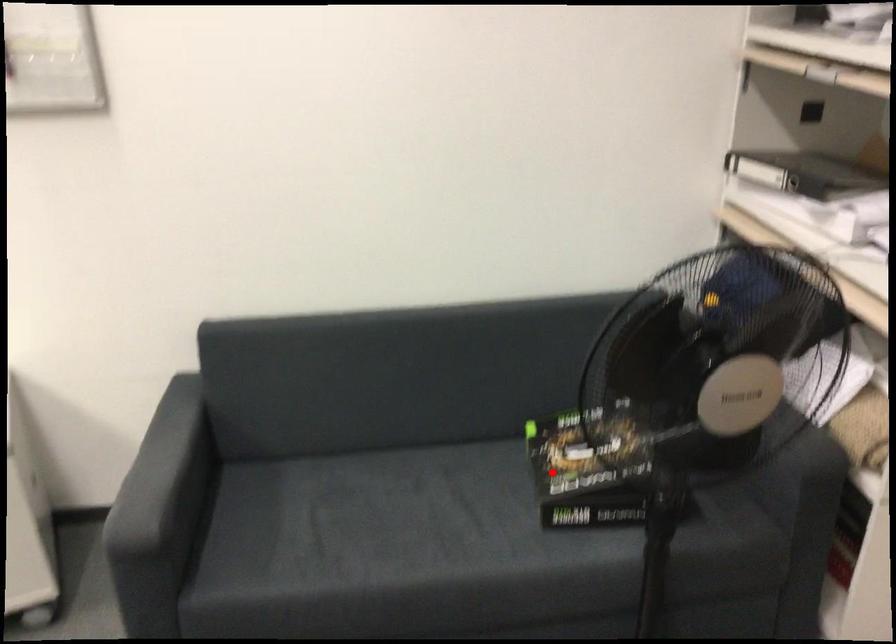
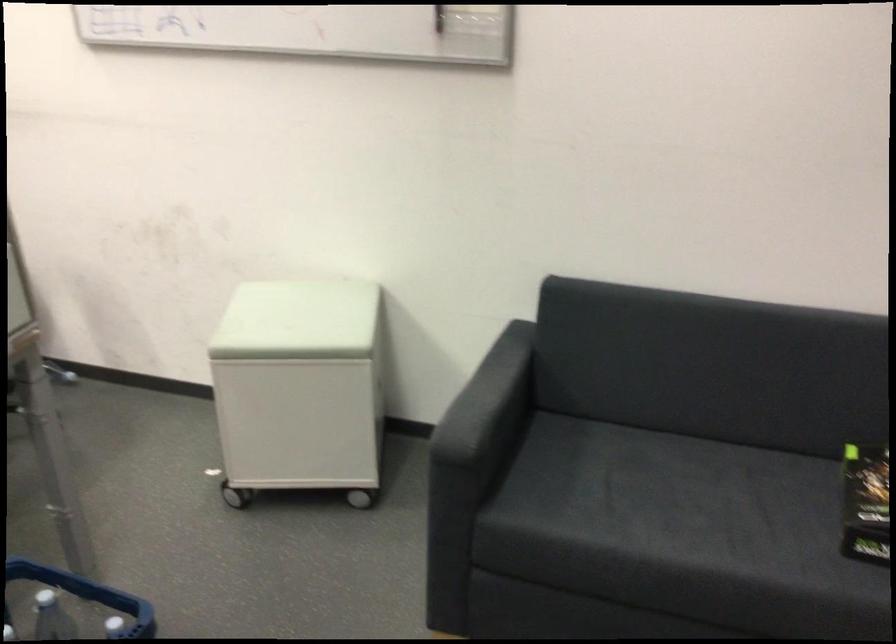
The point at the highlighted location is marked in the first image. Where is the corresponding point in the second image?

(866, 503)